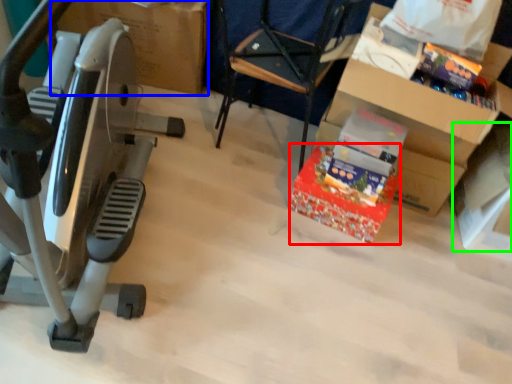
Question: Which is nearer to the gift (highlighted by a red box)? cardboard box (highlighted by a blue box) or box (highlighted by a green box).

Choices:
 (A) cardboard box
 (B) box

Answer: (B)